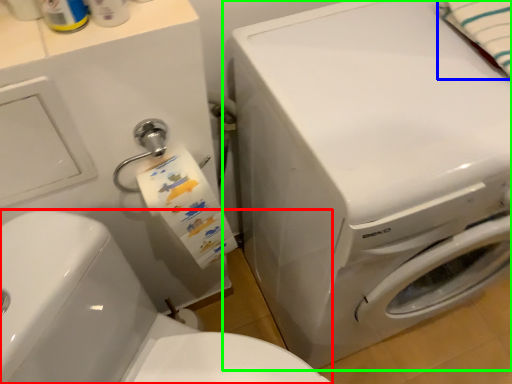
Question: Estimate the real-world distances between objects in this image. Which object is closer to washer (highlighted by a red box), bath towel (highlighted by a blue box) or washing machine (highlighted by a green box)?

Choices:
 (A) bath towel
 (B) washing machine

Answer: (B)